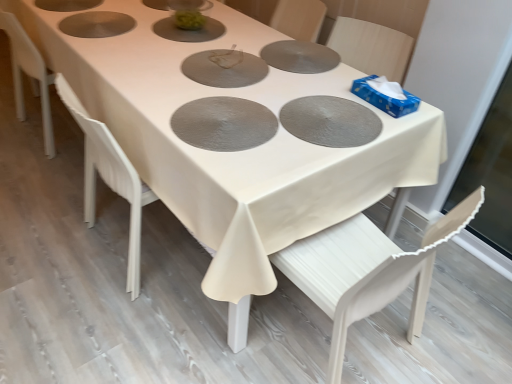
You are a GUI agent. You are given a task and a screenshot of the screen. Output one action in this format:
    pyautogui.click(x=<x>, y=<y>)
    Task: Click on the vacant area situated below matte gray pizza pan at center, which ranks as the 1th pizza pan in top-to-bottom order (from a real-world perspective)
    The image size is (512, 384).
    Given the screenshot: What is the action you would take?
    pyautogui.click(x=225, y=64)